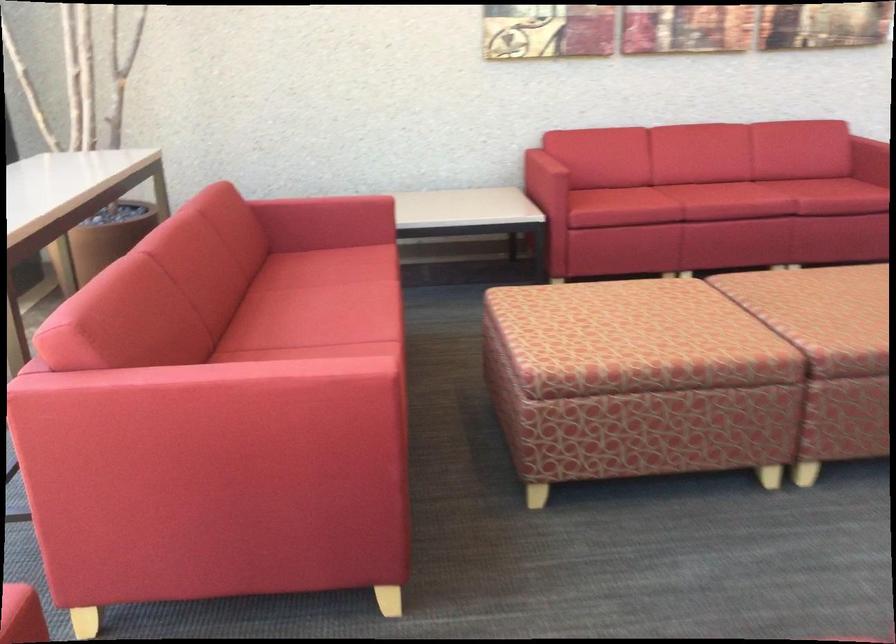
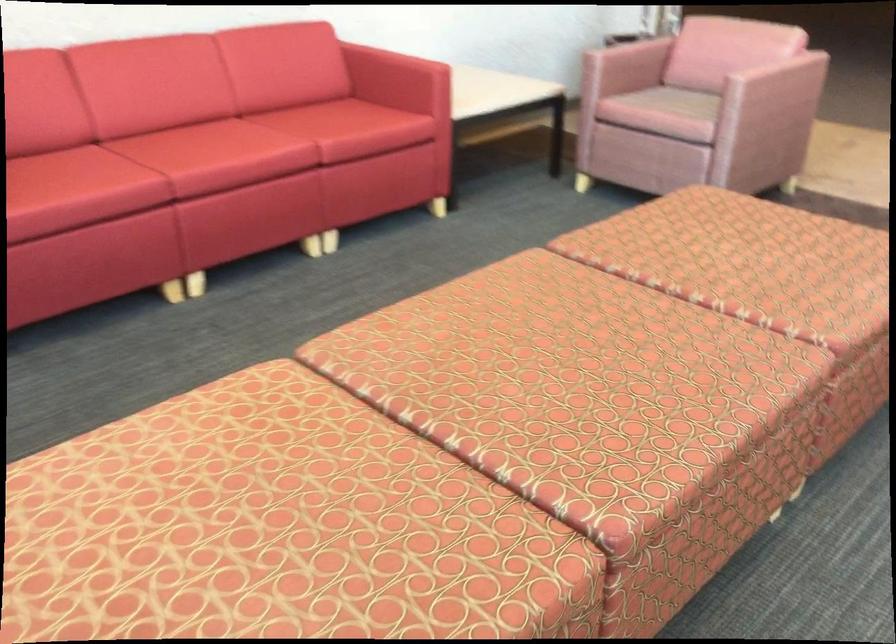
Where in the second image is the point corresponding to (x=703, y=185) from the first image?

(196, 144)